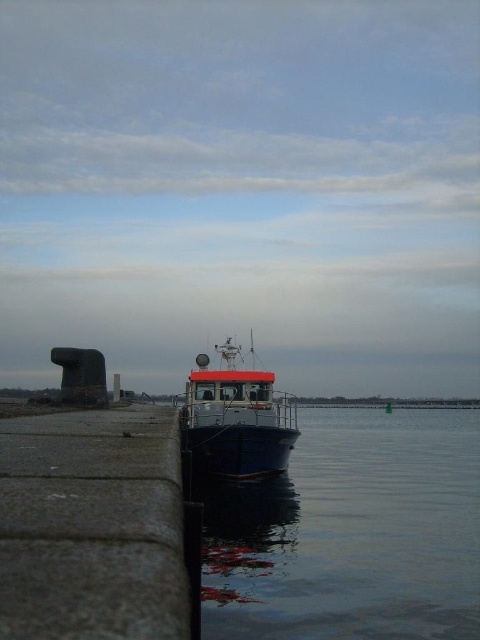
Question: Does smooth blue water at center come in front of blue metallic boat at center?

Choices:
 (A) no
 (B) yes

Answer: (B)

Question: Which object is farther from the camera taking this photo?

Choices:
 (A) smooth blue water at center
 (B) blue metallic boat at center

Answer: (B)

Question: Is smooth blue water at center above blue metallic boat at center?

Choices:
 (A) no
 (B) yes

Answer: (A)

Question: Can you confirm if granite-like ledge at lower left is smaller than blue metallic boat at center?

Choices:
 (A) yes
 (B) no

Answer: (A)

Question: Which point is closer to the camera taking this photo?

Choices:
 (A) [x=31, y=604]
 (B) [x=314, y=630]

Answer: (A)

Question: Which of these objects is positioned farthest from the smooth blue water at center?

Choices:
 (A) blue metallic boat at center
 (B) granite-like ledge at lower left

Answer: (B)